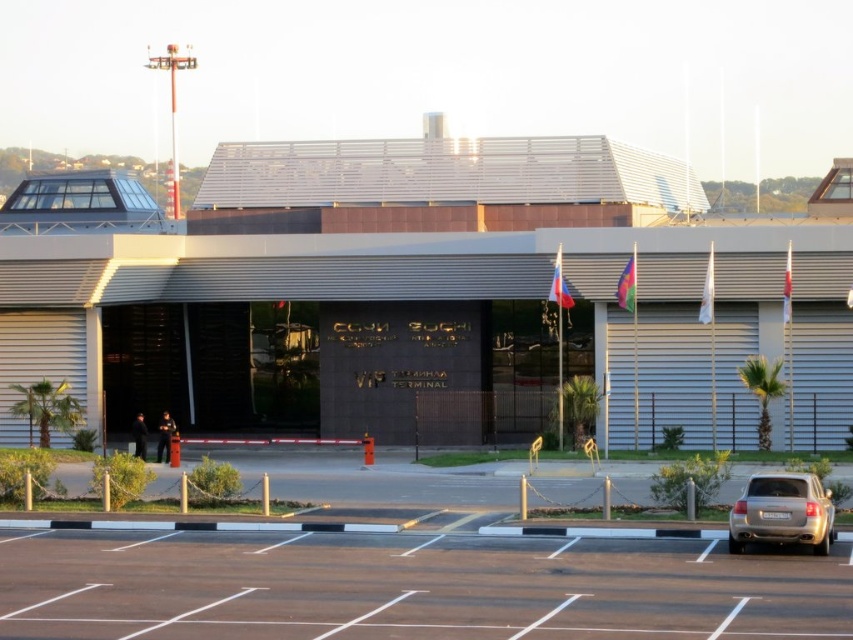
You are a visitor arriving at the VIP Terminal at Sochi International Airport. You notice a silver metallic sedan at lower right and a green leafy palm tree at left. Which object is taller?

The green leafy palm tree at left is taller than the silver metallic sedan at lower right.

From the picture: You are a landscape architect designing a pathway between the green leafy palm tree at left and the green leafy palm tree at center. Which tree should the pathway be closer to if you want to avoid blocking the view of the taller palm tree?

The pathway should be closer to the green leafy palm tree at left because the green leafy palm tree at center is taller, so keeping the pathway near the shorter tree would prevent obstructing the view of the taller one.

You are a visitor arriving at the VIP Terminal at Sochi International Airport. You need to park your car in the parking area. You see a silver metallic sedan at lower right and a green leafy palm tree at left. Which object is smaller in size?

The silver metallic sedan at lower right is smaller in size compared to the green leafy palm tree at left according to the description.